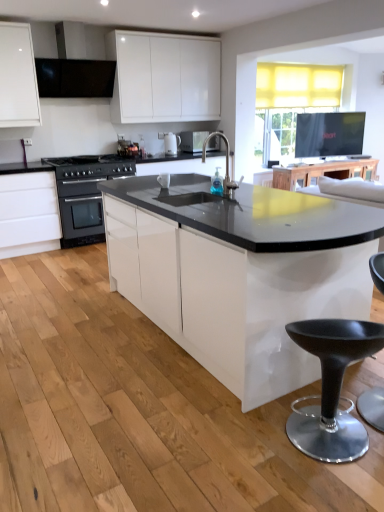
Question: Should I look upward or downward to see black plastic stool at lower right?

Choices:
 (A) up
 (B) down

Answer: (B)

Question: Can you confirm if translucent glass faucet at center is smaller than black plastic stool at lower right?

Choices:
 (A) no
 (B) yes

Answer: (B)

Question: Is translucent glass faucet at center in contact with black plastic stool at lower right?

Choices:
 (A) no
 (B) yes

Answer: (A)

Question: From a real-world perspective, is translucent glass faucet at center under black plastic stool at lower right?

Choices:
 (A) no
 (B) yes

Answer: (A)

Question: Does translucent glass faucet at center appear on the left side of black plastic stool at lower right?

Choices:
 (A) yes
 (B) no

Answer: (A)

Question: Does translucent glass faucet at center turn towards black plastic stool at lower right?

Choices:
 (A) yes
 (B) no

Answer: (B)

Question: Does translucent glass faucet at center have a lesser width compared to black plastic stool at lower right?

Choices:
 (A) no
 (B) yes

Answer: (B)

Question: Is wooden table at upper center bigger than translucent glass faucet at center?

Choices:
 (A) yes
 (B) no

Answer: (A)

Question: From the image's perspective, does wooden table at upper center appear lower than translucent glass faucet at center?

Choices:
 (A) yes
 (B) no

Answer: (B)

Question: Does wooden table at upper center turn towards translucent glass faucet at center?

Choices:
 (A) yes
 (B) no

Answer: (B)

Question: Considering the relative sizes of wooden table at upper center and translucent glass faucet at center in the image provided, is wooden table at upper center shorter than translucent glass faucet at center?

Choices:
 (A) no
 (B) yes

Answer: (B)

Question: Considering the relative positions of wooden table at upper center and translucent glass faucet at center in the image provided, is wooden table at upper center in front of translucent glass faucet at center?

Choices:
 (A) yes
 (B) no

Answer: (B)

Question: Does wooden table at upper center have a greater width compared to translucent glass faucet at center?

Choices:
 (A) yes
 (B) no

Answer: (A)

Question: From the image's perspective, is black plastic stool at lower right beneath black stainless steel oven at left?

Choices:
 (A) yes
 (B) no

Answer: (A)